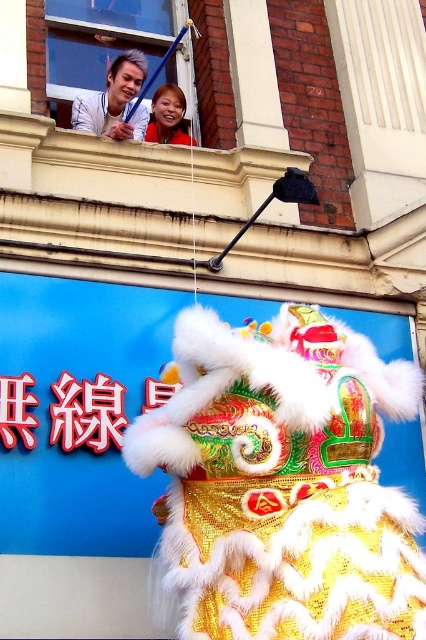
Looking at this image, can you confirm if clear glass window at upper center is positioned below matte white shirt at upper left?

No.

Locate an element on the screen. This screenshot has height=640, width=426. clear glass window at upper center is located at coordinates (101, 38).

The height and width of the screenshot is (640, 426). What do you see at coordinates (101, 38) in the screenshot? I see `clear glass window at upper center` at bounding box center [101, 38].

At what (x,y) coordinates should I click in order to perform the action: click on clear glass window at upper center. Please return your answer as a coordinate pair (x, y). The height and width of the screenshot is (640, 426). Looking at the image, I should click on (101, 38).

Does clear glass window at upper center have a smaller size compared to smooth skin face at upper center?

No, clear glass window at upper center is not smaller than smooth skin face at upper center.

Between clear glass window at upper center and smooth skin face at upper center, which one is positioned higher?

clear glass window at upper center

Identify the location of clear glass window at upper center. The image size is (426, 640). (101, 38).

The height and width of the screenshot is (640, 426). Find the location of `clear glass window at upper center`. clear glass window at upper center is located at coordinates (101, 38).

Locate an element on the screen. fuzzy golden lion at center is located at coordinates (282, 483).

Can you confirm if fuzzy golden lion at center is thinner than smooth skin face at upper center?

No, fuzzy golden lion at center is not thinner than smooth skin face at upper center.

Is point (402, 388) farther from viewer compared to point (169, 96)?

That is False.

Locate an element on the screen. Image resolution: width=426 pixels, height=640 pixels. fuzzy golden lion at center is located at coordinates (282, 483).